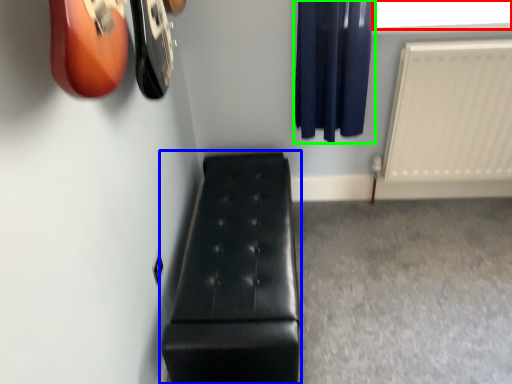
Question: Based on their relative distances, which object is nearer to window screen (highlighted by a red box)? Choose from furniture (highlighted by a blue box) and curtain (highlighted by a green box).

Choices:
 (A) furniture
 (B) curtain

Answer: (B)